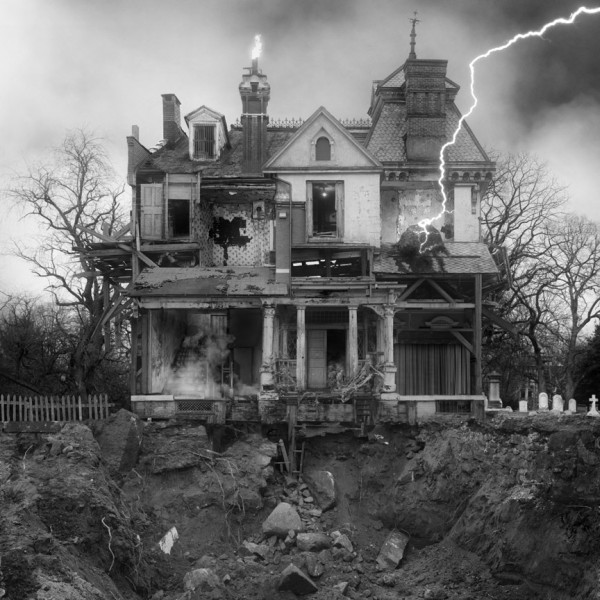
At what (x,y) coordinates should I click in order to perform the action: click on column. Please return your answer as a coordinate pair (x, y). Looking at the image, I should click on (354, 329), (299, 346), (263, 334), (380, 337), (386, 350).